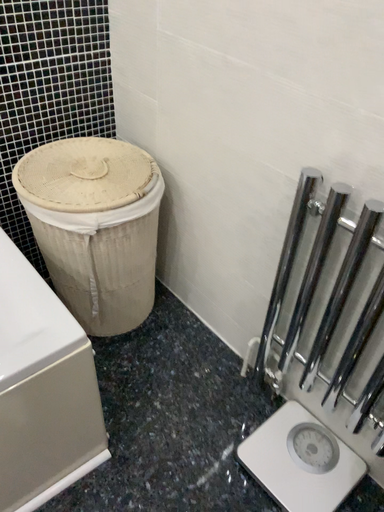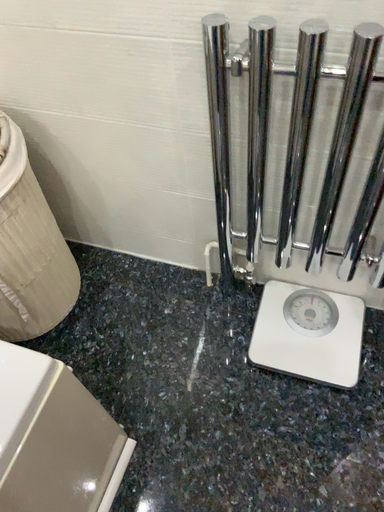
Question: Which way did the camera rotate in the video?

Choices:
 (A) rotated downward
 (B) rotated upward

Answer: (A)